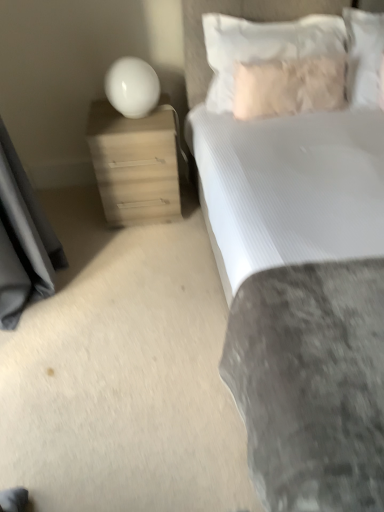
Question: Is white textured bed at upper right wider than white glossy sphere at upper left?

Choices:
 (A) yes
 (B) no

Answer: (A)

Question: Can you confirm if white textured bed at upper right is thinner than white glossy sphere at upper left?

Choices:
 (A) no
 (B) yes

Answer: (A)

Question: Does white textured bed at upper right come in front of white glossy sphere at upper left?

Choices:
 (A) yes
 (B) no

Answer: (A)

Question: Is white textured bed at upper right far from white glossy sphere at upper left?

Choices:
 (A) yes
 (B) no

Answer: (A)

Question: Is white textured bed at upper right placed right next to white glossy sphere at upper left?

Choices:
 (A) no
 (B) yes

Answer: (A)

Question: Does point (354, 69) appear closer or farther from the camera than point (172, 119)?

Choices:
 (A) closer
 (B) farther

Answer: (B)

Question: From a real-world perspective, is white soft pillow at upper right, the 1th pillow in the right-to-left sequence, physically located above or below matte wood nightstand at left?

Choices:
 (A) above
 (B) below

Answer: (A)

Question: Looking at the image, does white soft pillow at upper right, the 1th pillow in the right-to-left sequence, seem bigger or smaller compared to matte wood nightstand at left?

Choices:
 (A) big
 (B) small

Answer: (B)

Question: From the image's perspective, is white soft pillow at upper right, the 3th pillow positioned from the left, positioned above or below matte wood nightstand at left?

Choices:
 (A) above
 (B) below

Answer: (A)

Question: Does point (248, 31) appear closer or farther from the camera than point (289, 98)?

Choices:
 (A) closer
 (B) farther

Answer: (A)

Question: Considering the positions of white soft pillow at upper right, which is the 3th pillow from right to left, and fuzzy beige pillow at upper right, which is the second pillow from right to left, in the image, is white soft pillow at upper right, which is the 3th pillow from right to left, bigger or smaller than fuzzy beige pillow at upper right, which is the second pillow from right to left,?

Choices:
 (A) big
 (B) small

Answer: (A)

Question: Is white soft pillow at upper right, which is the 3th pillow from right to left, in front of or behind fuzzy beige pillow at upper right, which is the second pillow from right to left, in the image?

Choices:
 (A) front
 (B) behind

Answer: (A)

Question: From a real-world perspective, is white soft pillow at upper right, which is the 3th pillow from right to left, above or below fuzzy beige pillow at upper right, which ranks as the 2th pillow in left-to-right order?

Choices:
 (A) above
 (B) below

Answer: (A)

Question: Would you say white soft pillow at upper right, the 1th pillow in the right-to-left sequence, is inside or outside fuzzy beige pillow at upper right, which ranks as the 2th pillow in left-to-right order?

Choices:
 (A) outside
 (B) inside

Answer: (A)

Question: Relative to fuzzy beige pillow at upper right, which ranks as the 2th pillow in left-to-right order, is white soft pillow at upper right, the 1th pillow in the right-to-left sequence, in front or behind?

Choices:
 (A) behind
 (B) front

Answer: (A)